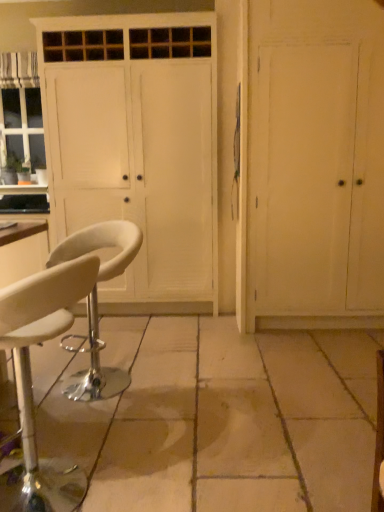
Question: Considering the positions of point (87, 79) and point (119, 243), is point (87, 79) closer or farther from the camera than point (119, 243)?

Choices:
 (A) closer
 (B) farther

Answer: (B)

Question: Do you think white wood cabinet at center is within white leather stool at lower left, the first chair when ordered from back to front, or outside of it?

Choices:
 (A) outside
 (B) inside

Answer: (A)

Question: Estimate the real-world distances between objects in this image. Which object is closer to the white wood cabinet at center?

Choices:
 (A) white wood door at right
 (B) beige stone floor at center
 (C) white leather stool at lower left, the second chair from the front
 (D) white leather stool at lower left, the second chair from the back

Answer: (A)

Question: Which object is the closest to the white leather stool at lower left, placed as the 1th chair when sorted from front to back?

Choices:
 (A) white wood door at right
 (B) beige stone floor at center
 (C) white wood cabinet at center
 (D) white leather stool at lower left, the second chair from the front

Answer: (D)